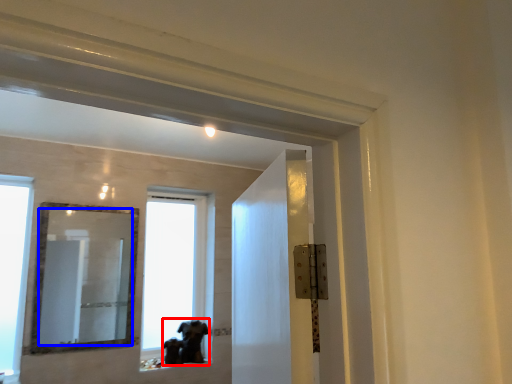
Question: Which object is closer to the camera taking this photo, animal (highlighted by a red box) or mirror (highlighted by a blue box)?

Choices:
 (A) animal
 (B) mirror

Answer: (B)